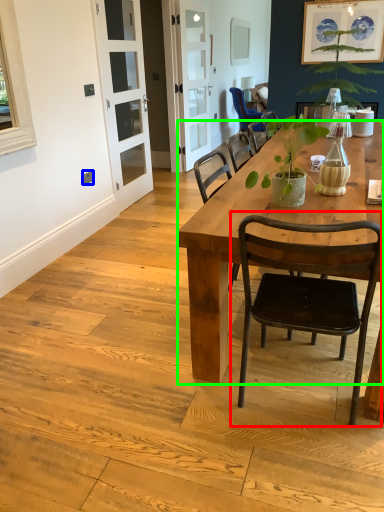
Question: Considering the real-world distances, which object is closest to chair (highlighted by a red box)? power outlet (highlighted by a blue box) or desk (highlighted by a green box).

Choices:
 (A) power outlet
 (B) desk

Answer: (B)